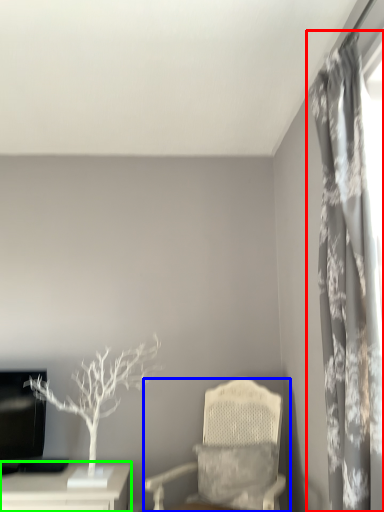
Question: Based on their relative distances, which object is nearer to curtain (highlighted by a red box)? Choose from chair (highlighted by a blue box) and table (highlighted by a green box).

Choices:
 (A) chair
 (B) table

Answer: (A)